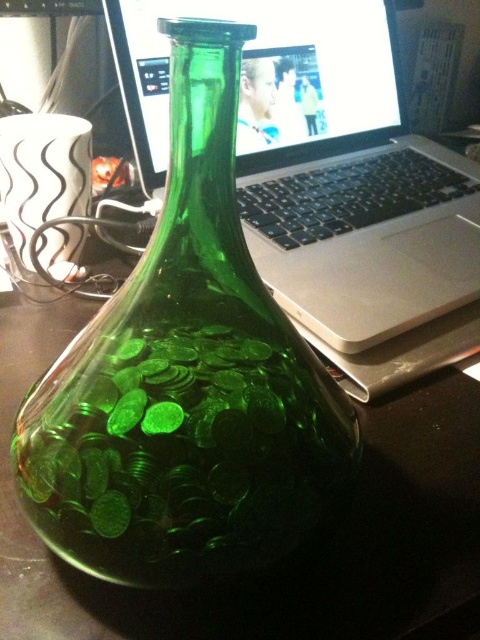
Question: Is green glass vase at center to the right of sleek silver laptop at center from the viewer's perspective?

Choices:
 (A) no
 (B) yes

Answer: (A)

Question: Is green glass vase at center below sleek silver laptop at center?

Choices:
 (A) no
 (B) yes

Answer: (B)

Question: Which point is farther to the camera?

Choices:
 (A) green glass vase at center
 (B) sleek silver laptop at center

Answer: (B)

Question: From the image, what is the correct spatial relationship of green glass vase at center in relation to sleek silver laptop at center?

Choices:
 (A) right
 (B) left

Answer: (B)

Question: Which object is farther from the camera taking this photo?

Choices:
 (A) green glass vase at center
 (B) sleek silver laptop at center

Answer: (B)

Question: Among these points, which one is farthest from the camera?

Choices:
 (A) (271, 374)
 (B) (285, 74)

Answer: (B)